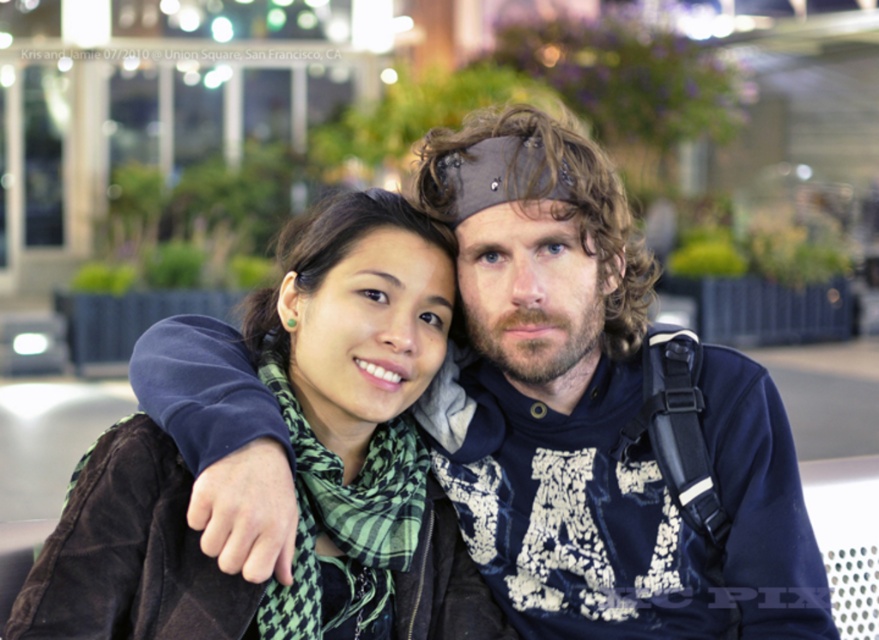
Question: Can you confirm if velvet blue sweatshirt at center is positioned to the left of green plaid scarf at center?

Choices:
 (A) no
 (B) yes

Answer: (A)

Question: Can you confirm if velvet blue sweatshirt at center is positioned above green plaid scarf at center?

Choices:
 (A) yes
 (B) no

Answer: (A)

Question: Which of the following is the closest to the observer?

Choices:
 (A) velvet blue sweatshirt at center
 (B) green plaid scarf at center

Answer: (B)

Question: Which object is farther from the camera taking this photo?

Choices:
 (A) velvet blue sweatshirt at center
 (B) green plaid scarf at center

Answer: (A)

Question: Can you confirm if velvet blue sweatshirt at center is positioned above green plaid scarf at center?

Choices:
 (A) yes
 (B) no

Answer: (A)